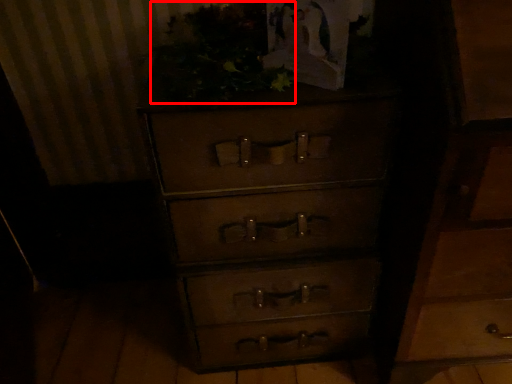
Question: From the image's perspective, considering the relative positions of vegetation (annotated by the red box) and chest of drawers in the image provided, where is vegetation (annotated by the red box) located with respect to the staircase?

Choices:
 (A) above
 (B) below

Answer: (A)